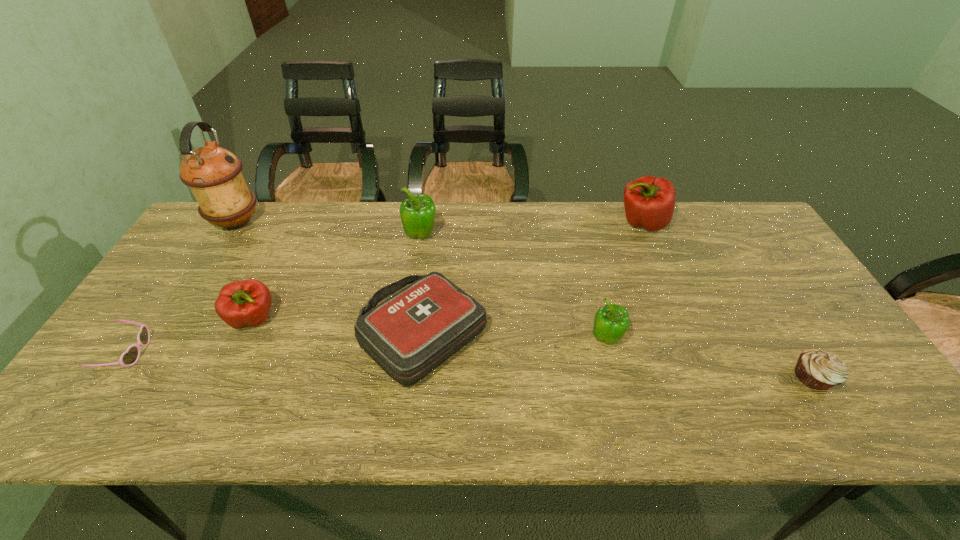
This screenshot has width=960, height=540. What are the coordinates of `free spot between the smaller pink bell pepper and the second object from right to left` in the screenshot? It's located at (447, 271).

Image resolution: width=960 pixels, height=540 pixels. Find the location of `object that is the third closest to the smaller pink bell pepper`. object that is the third closest to the smaller pink bell pepper is located at coordinates (213, 174).

The image size is (960, 540). I want to click on object that is the third closest one to the shortest object, so click(409, 335).

Point out which bell pepper is positioned as the third nearest to the second object from right to left. Please provide its 2D coordinates. Your answer should be formatted as a tuple, i.e. [(x, y)], where the tuple contains the x and y coordinates of a point satisfying the conditions above.

[(244, 303)]

What are the coordinates of `bell pepper that is the third closest one to the rightmost bell pepper` in the screenshot? It's located at (244, 303).

The image size is (960, 540). What are the coordinates of `vacant space that satisfies the following two spatial constraints: 1. on the front side of the rightmost bell pepper; 2. on the front-facing side of the pink sunglasses` in the screenshot? It's located at (696, 353).

This screenshot has width=960, height=540. I want to click on free space in the image that satisfies the following two spatial constraints: 1. on the front side of the third bell pepper from right to left; 2. on the front-facing side of the shortest object, so click(x=403, y=353).